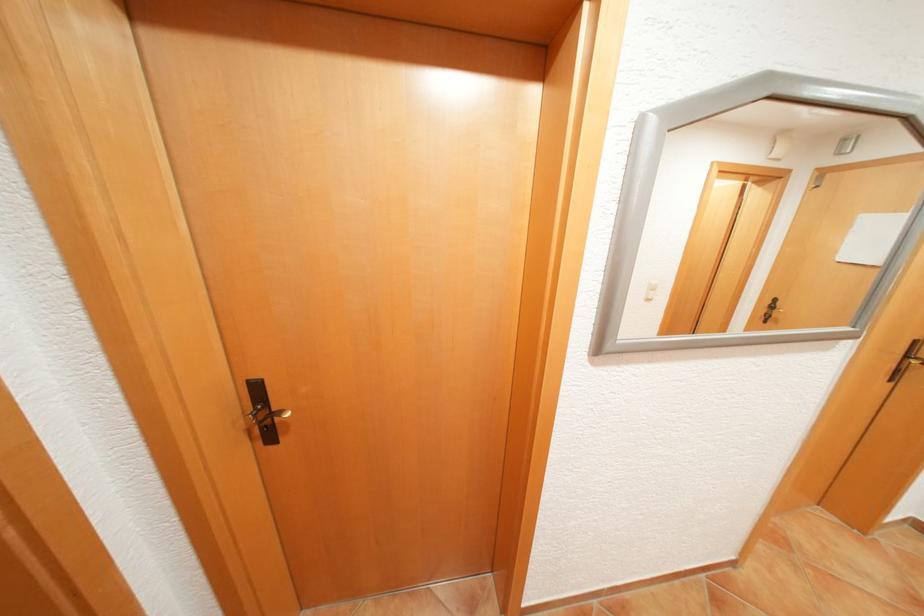
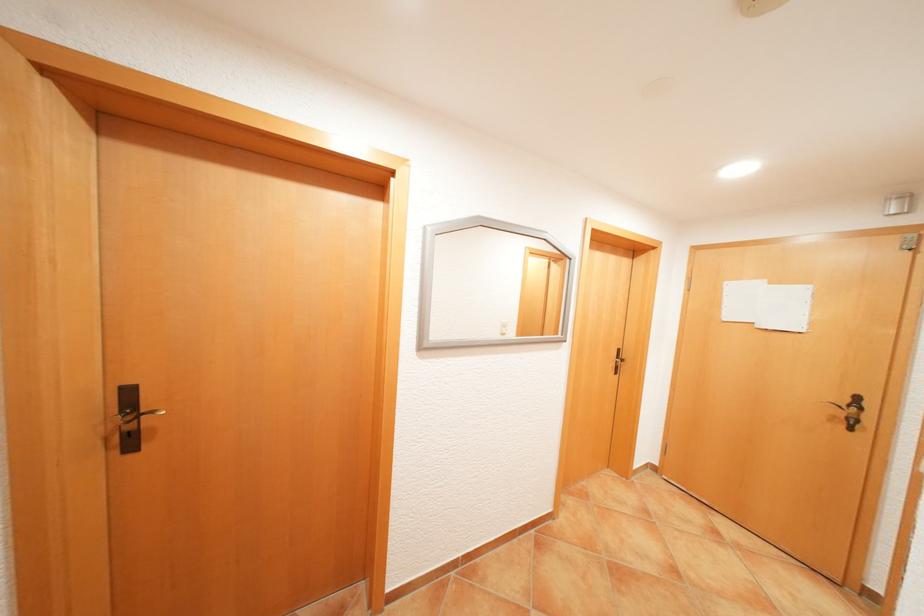
Question: The images are taken continuously from a first-person perspective. In which direction is your viewpoint rotating?

Choices:
 (A) Left
 (B) Right
 (C) Up
 (D) Down

Answer: (B)